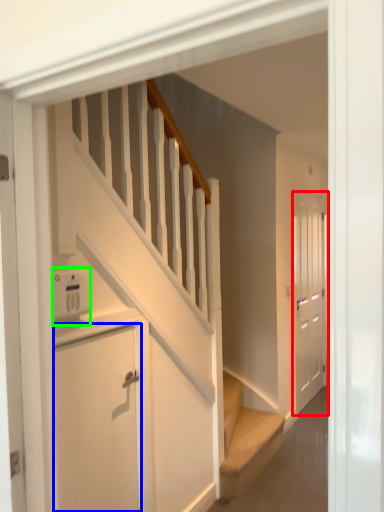
Question: Based on their relative distances, which object is farther from door (highlighted by a red box)? Choose from door (highlighted by a blue box) and appliance (highlighted by a green box).

Choices:
 (A) door
 (B) appliance

Answer: (B)